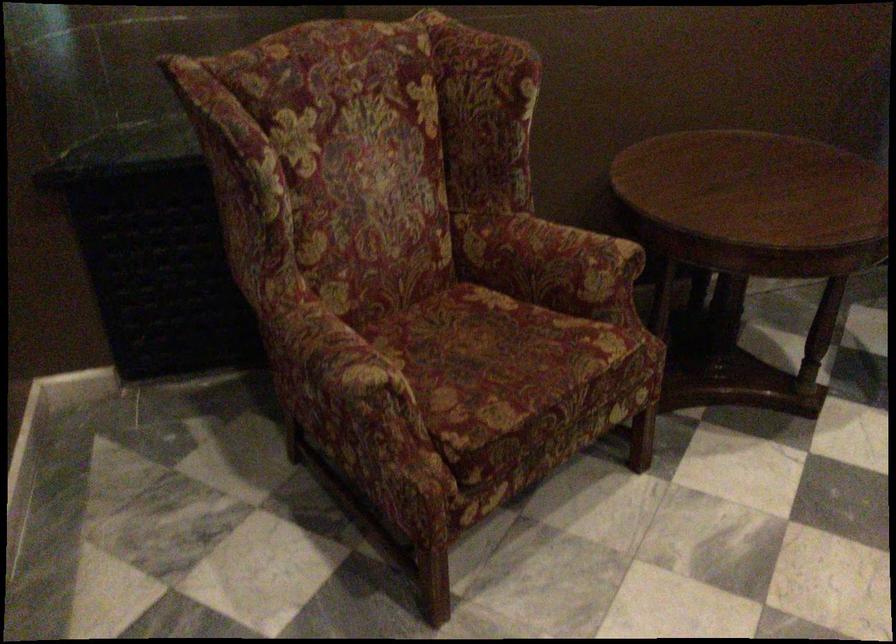
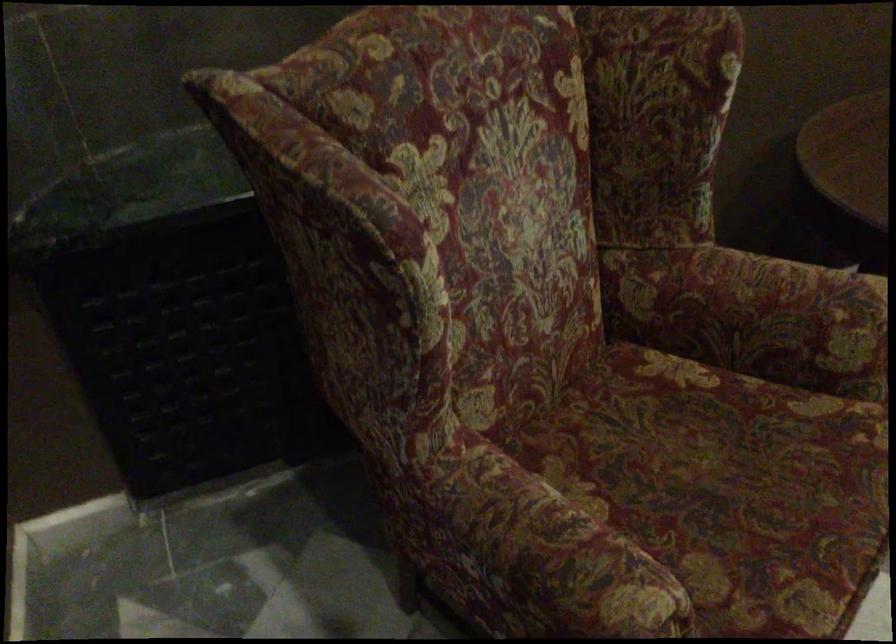
In the second image, find the point that corresponds to point (324, 354) in the first image.

(543, 559)